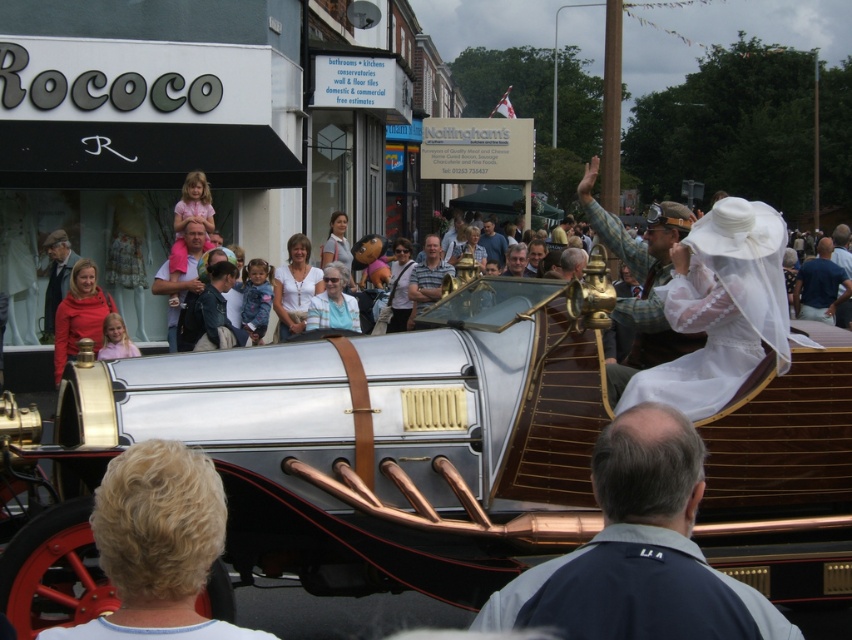
Question: Which point is closer to the camera?

Choices:
 (A) (818, 284)
 (B) (459, 298)

Answer: (B)

Question: Considering the relative positions of dark blue fabric jacket at center and camouflage fabric hat at upper center in the image provided, where is dark blue fabric jacket at center located with respect to camouflage fabric hat at upper center?

Choices:
 (A) left
 (B) right

Answer: (A)

Question: Does white sheer dress at upper center appear on the left side of camouflage fabric hat at upper center?

Choices:
 (A) no
 (B) yes

Answer: (B)

Question: Which of these objects is positioned farthest from the matte black suit at center?

Choices:
 (A) light blue denim shirt at center
 (B) camouflage fabric hat at upper center

Answer: (A)

Question: Is white sheer dress at upper center closer to the viewer compared to camouflage fabric hat at upper center?

Choices:
 (A) yes
 (B) no

Answer: (A)

Question: Which object is the farthest from the polished silver car at center?

Choices:
 (A) gray striped shirt at center
 (B) camouflage fabric hat at upper center
 (C) matte black suit at center
 (D) dark blue fabric jacket at center

Answer: (C)